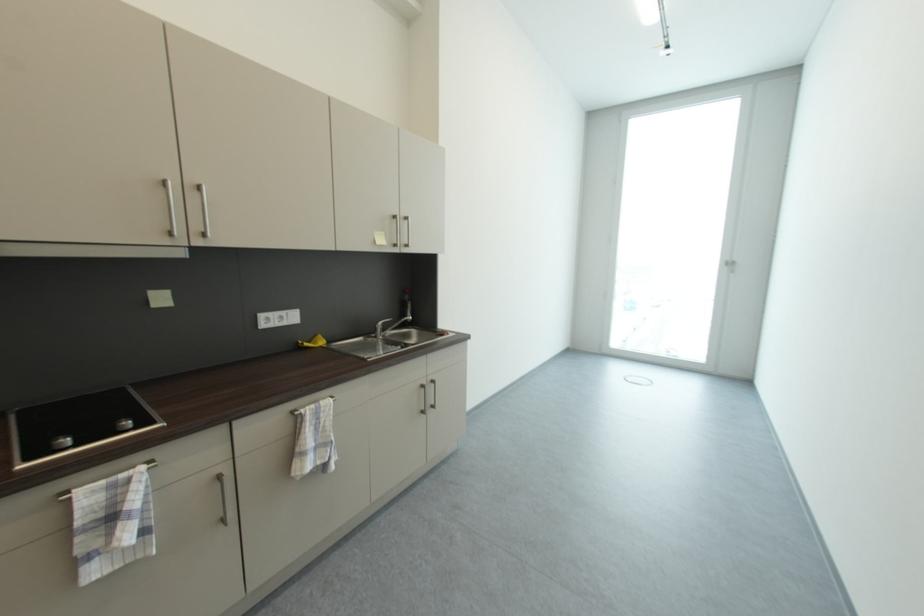
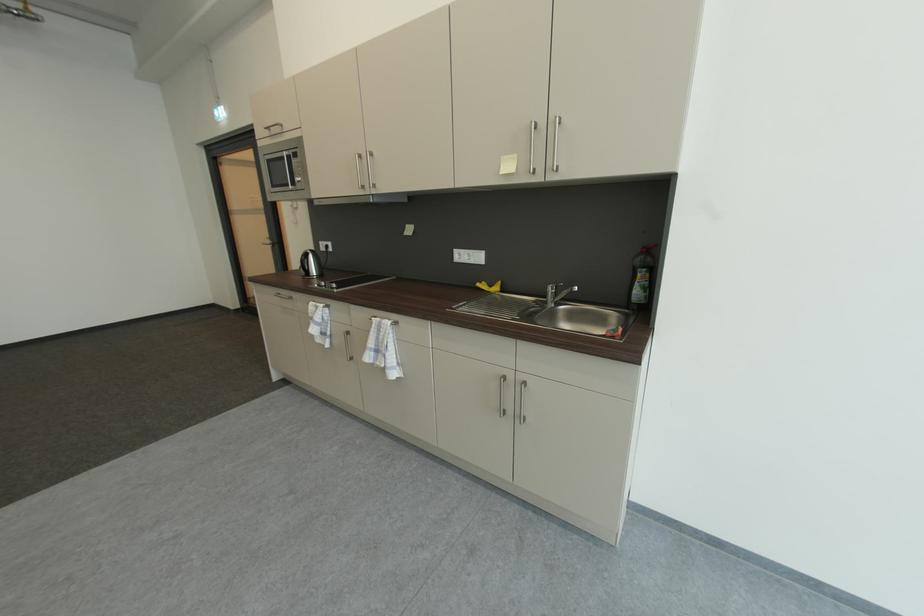
Find the pixel in the second image that matches point 292,325 in the first image.

(479, 262)